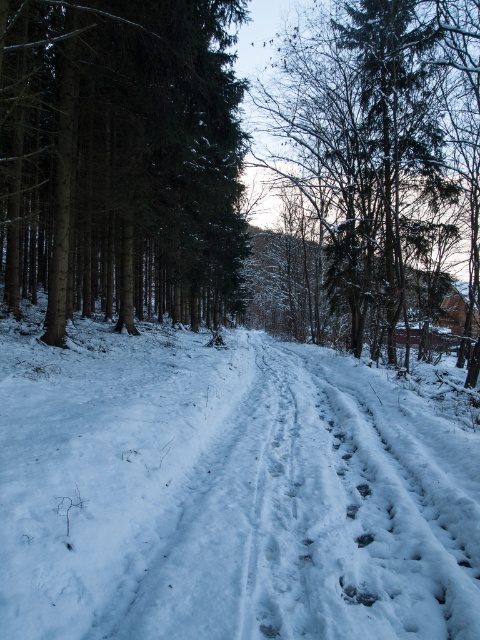
You are standing at the point marked as point [121,160] in the winter forest scene. What object is exactly at that point?

The green matte tree at left is exactly at point [121,160].